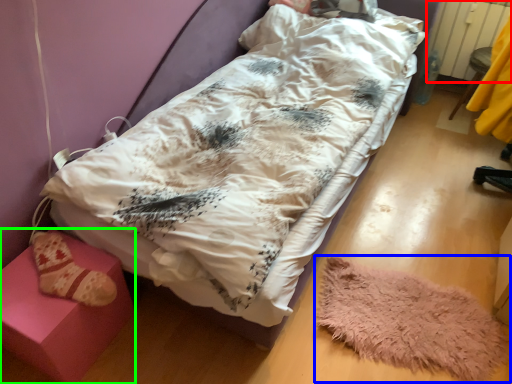
Question: Based on their relative distances, which object is nearer to radiator (highlighted by a red box)? Choose from mat (highlighted by a blue box) and furniture (highlighted by a green box).

Choices:
 (A) mat
 (B) furniture

Answer: (A)